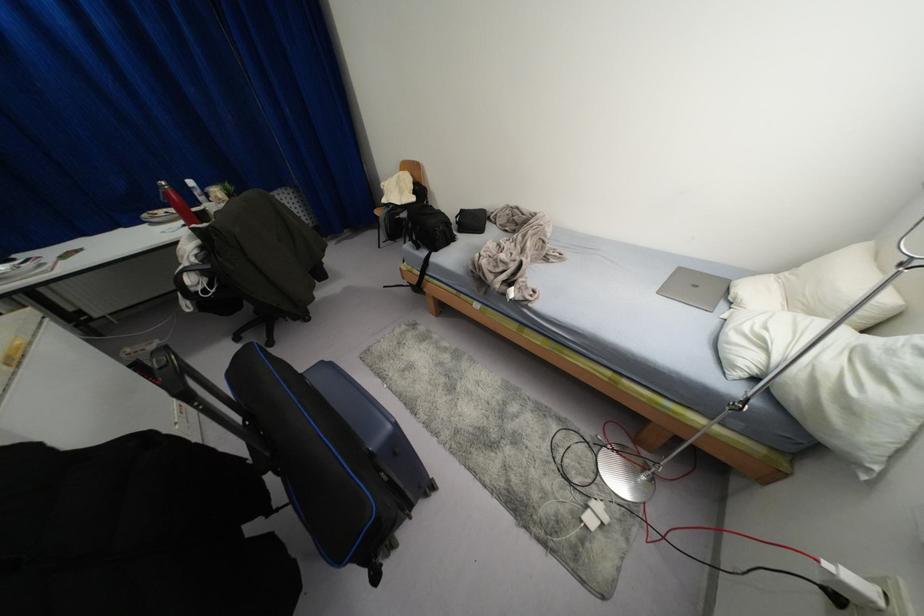
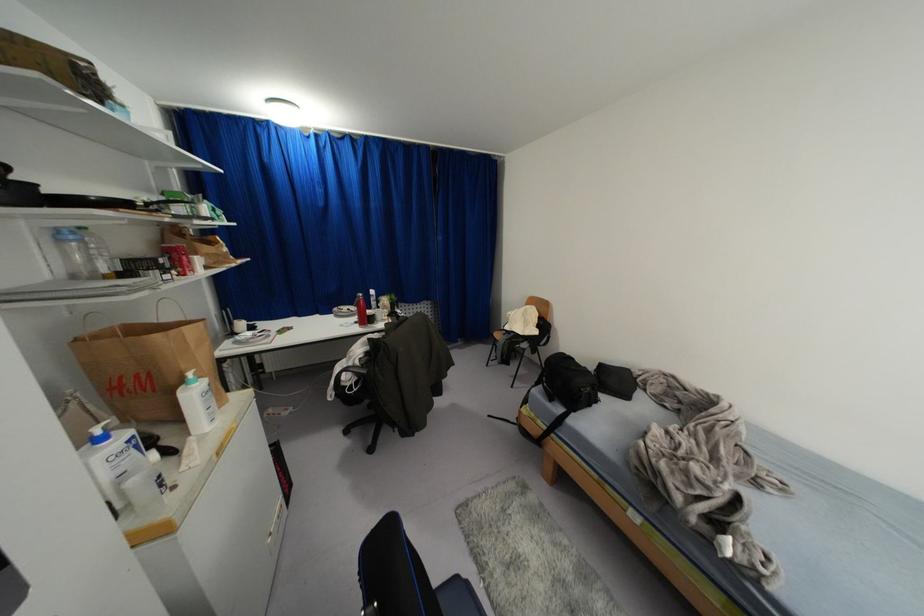
The images are taken continuously from a first-person perspective. In which direction is your viewpoint rotating?

The rotation direction of the camera is left-up.